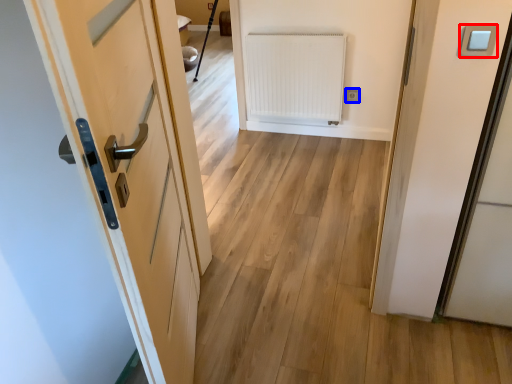
Question: Which object is further to the camera taking this photo, light switch (highlighted by a red box) or electric outlet (highlighted by a blue box)?

Choices:
 (A) light switch
 (B) electric outlet

Answer: (B)